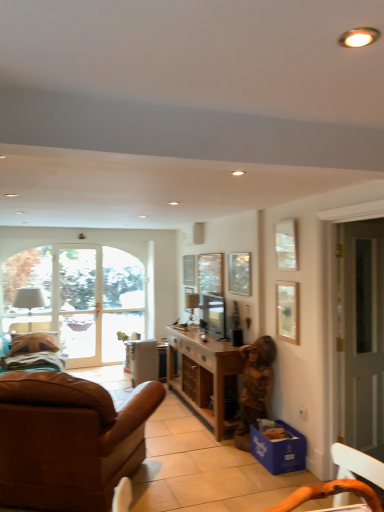
I want to click on free space to the left of blue cardboard box at lower right, so click(x=238, y=463).